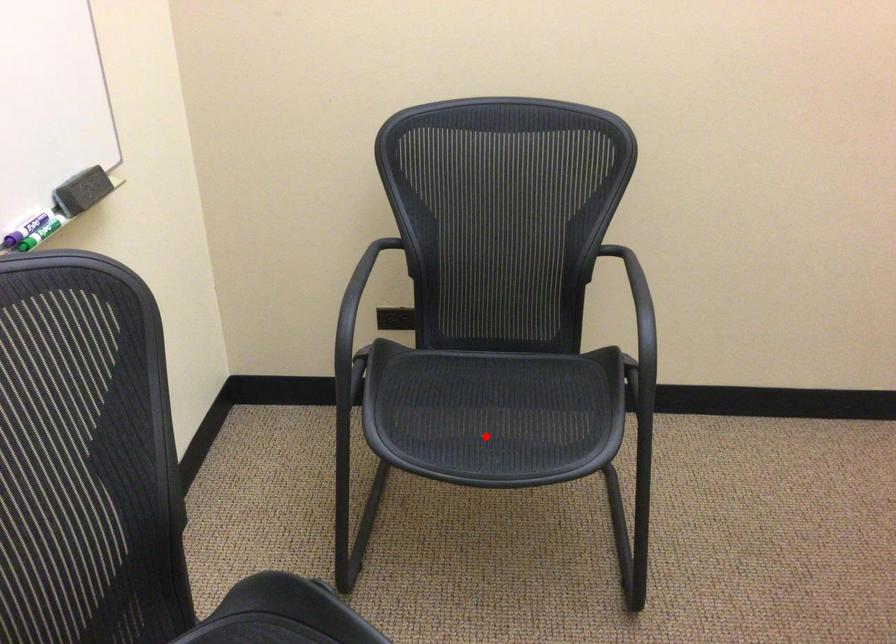
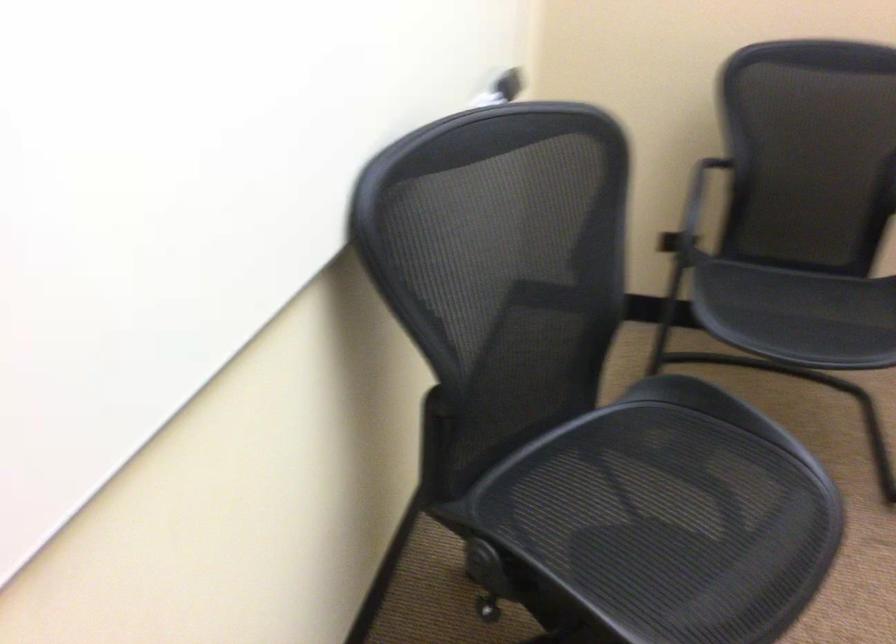
Question: I am providing you with two images of the same scene from different viewpoints. In image1, a red point is highlighted. Considering the same 3D point in image2, which of the following is correct?

Choices:
 (A) It is closer
 (B) It is farther

Answer: (B)